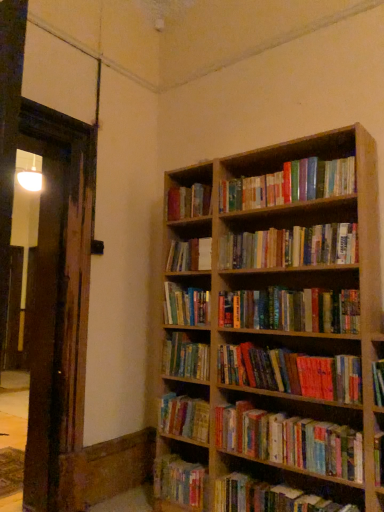
Question: From a real-world perspective, does hardcover books at center, which ranks as the tenth book in bottom-to-top order, sit lower than hardcover books at center, which is the eighth book from top to bottom?

Choices:
 (A) no
 (B) yes

Answer: (A)

Question: Does hardcover books at center, the third book from the top, have a greater height compared to hardcover books at center, which is the eighth book from top to bottom?

Choices:
 (A) yes
 (B) no

Answer: (B)

Question: Does hardcover books at center, the third book from the top, touch hardcover books at center, the fifth book positioned from the bottom?

Choices:
 (A) yes
 (B) no

Answer: (B)

Question: Is hardcover books at center, the third book from the top, at the right side of hardcover books at center, which is the eighth book from top to bottom?

Choices:
 (A) yes
 (B) no

Answer: (A)

Question: Is hardcover books at center, which ranks as the tenth book in bottom-to-top order, positioned with its back to hardcover books at center, the fifth book positioned from the bottom?

Choices:
 (A) no
 (B) yes

Answer: (A)

Question: Based on their positions, is hardcover book at lower center, the first book when ordered from bottom to top, located to the left or right of multicolored paperbacks at center, which appears as the fourth book when ordered from the bottom?

Choices:
 (A) left
 (B) right

Answer: (A)

Question: Does point (193, 483) appear closer or farther from the camera than point (261, 432)?

Choices:
 (A) farther
 (B) closer

Answer: (A)

Question: In the image, is hardcover book at lower center, the first book when ordered from bottom to top, positioned in front of or behind multicolored paperbacks at center, the 9th book positioned from the top?

Choices:
 (A) front
 (B) behind

Answer: (B)

Question: From their relative heights in the image, would you say hardcover book at lower center, the 12th book when ordered from top to bottom, is taller or shorter than multicolored paperbacks at center, which appears as the fourth book when ordered from the bottom?

Choices:
 (A) short
 (B) tall

Answer: (A)

Question: Is multicolored paperbacks at center, the tenth book from the top, inside the boundaries of multicolored paperbacks at center, the 9th book positioned from the top, or outside?

Choices:
 (A) outside
 (B) inside

Answer: (A)

Question: Looking at their shapes, would you say multicolored paperbacks at center, which ranks as the 3th book in bottom-to-top order, is wider or thinner than multicolored paperbacks at center, the 9th book positioned from the top?

Choices:
 (A) thin
 (B) wide

Answer: (B)

Question: In the image, is multicolored paperbacks at center, which ranks as the 3th book in bottom-to-top order, on the left side or the right side of multicolored paperbacks at center, the 9th book positioned from the top?

Choices:
 (A) right
 (B) left

Answer: (B)

Question: Does point (200, 415) appear closer or farther from the camera than point (284, 453)?

Choices:
 (A) closer
 (B) farther

Answer: (B)

Question: In terms of width, does hardcover book at center, positioned as the 6th book in top-to-bottom order, look wider or thinner when compared to multicolored paperbacks at upper center, which is the first book in top-to-bottom order?

Choices:
 (A) wide
 (B) thin

Answer: (A)

Question: Is hardcover book at center, which ranks as the seventh book in bottom-to-top order, inside the boundaries of multicolored paperbacks at upper center, which is the first book in top-to-bottom order, or outside?

Choices:
 (A) inside
 (B) outside

Answer: (B)